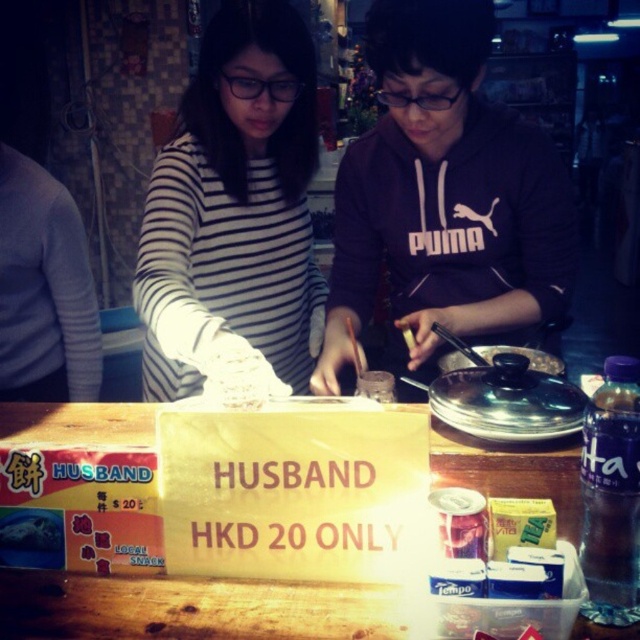
Question: Is the position of striped fabric shirt at left less distant than that of wooden table at center?

Choices:
 (A) no
 (B) yes

Answer: (A)

Question: Which object is closer to the camera taking this photo?

Choices:
 (A) wooden table at center
 (B) striped fabric shirt at left

Answer: (A)

Question: Does striped fabric shirt at left have a lesser width compared to white matte gloves at center?

Choices:
 (A) yes
 (B) no

Answer: (B)

Question: Which point appears farthest from the camera in this image?

Choices:
 (A) (344, 230)
 (B) (97, 634)

Answer: (A)

Question: Which point is closer to the camera?

Choices:
 (A) white matte gloves at center
 (B) wooden table at center

Answer: (B)

Question: Can you confirm if striped fabric shirt at left is smaller than white matte gloves at center?

Choices:
 (A) no
 (B) yes

Answer: (A)